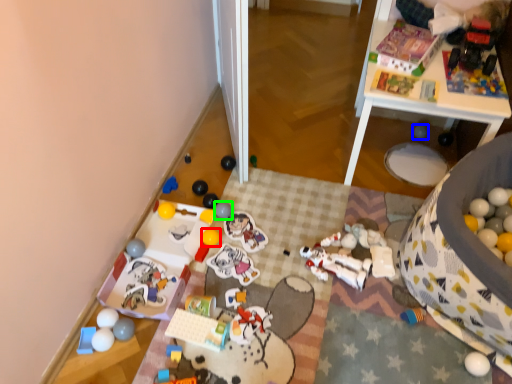
Question: Estimate the real-world distances between objects in this image. Which object is closer to toy (highlighted by a red box), toy (highlighted by a blue box) or toy (highlighted by a green box)?

Choices:
 (A) toy
 (B) toy

Answer: (B)